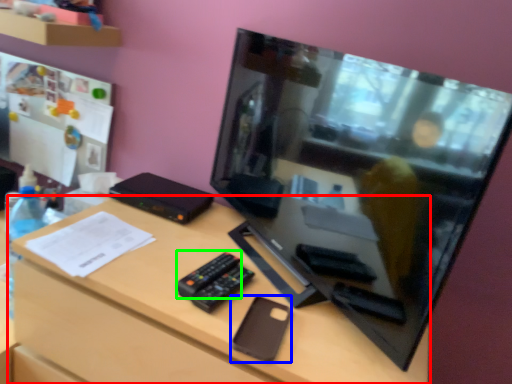
Question: Considering the real-world distances, which object is closest to desk (highlighted by a red box)? gadget (highlighted by a blue box) or remote (highlighted by a green box).

Choices:
 (A) gadget
 (B) remote

Answer: (B)